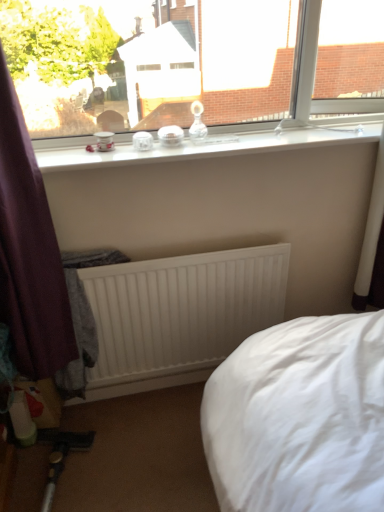
Question: Considering the relative positions of white matte radiator at center and transparent glass window at upper center in the image provided, is white matte radiator at center to the left of transparent glass window at upper center from the viewer's perspective?

Choices:
 (A) no
 (B) yes

Answer: (B)

Question: Considering the relative sizes of white matte radiator at center and transparent glass window at upper center in the image provided, is white matte radiator at center wider than transparent glass window at upper center?

Choices:
 (A) no
 (B) yes

Answer: (A)

Question: Does white matte radiator at center come behind transparent glass window at upper center?

Choices:
 (A) yes
 (B) no

Answer: (A)

Question: Does white matte radiator at center have a lesser height compared to transparent glass window at upper center?

Choices:
 (A) yes
 (B) no

Answer: (B)

Question: Is white matte radiator at center touching transparent glass window at upper center?

Choices:
 (A) yes
 (B) no

Answer: (B)

Question: Is white matte radiator at center thinner than transparent glass window at upper center?

Choices:
 (A) yes
 (B) no

Answer: (A)

Question: Is clear glass jars at upper center touching white matte radiator at center?

Choices:
 (A) yes
 (B) no

Answer: (B)

Question: Is clear glass jars at upper center taller than white matte radiator at center?

Choices:
 (A) no
 (B) yes

Answer: (A)

Question: Is the depth of clear glass jars at upper center greater than that of white matte radiator at center?

Choices:
 (A) no
 (B) yes

Answer: (A)

Question: From the image's perspective, is clear glass jars at upper center under white matte radiator at center?

Choices:
 (A) no
 (B) yes

Answer: (A)

Question: Is clear glass jars at upper center outside of white matte radiator at center?

Choices:
 (A) yes
 (B) no

Answer: (A)

Question: Considering the relative positions of clear glass jars at upper center and white matte radiator at center in the image provided, is clear glass jars at upper center in front of white matte radiator at center?

Choices:
 (A) no
 (B) yes

Answer: (B)

Question: From a real-world perspective, is clear glass jars at upper center located higher than transparent glass window at upper center?

Choices:
 (A) yes
 (B) no

Answer: (B)